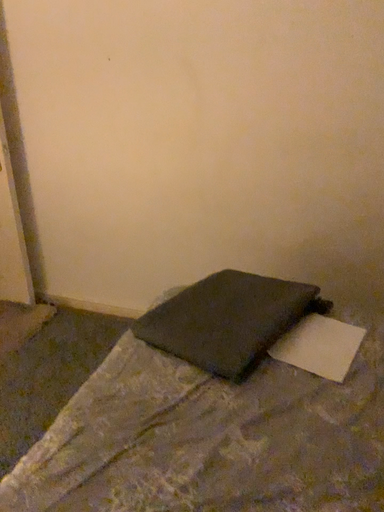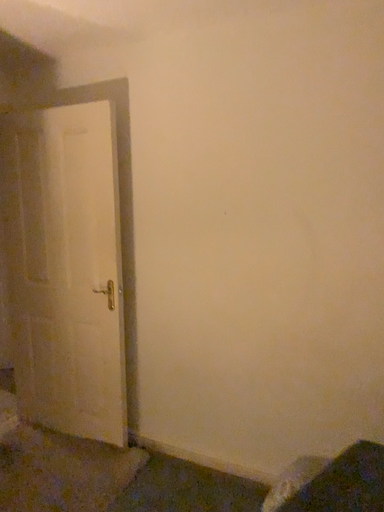
Question: How did the camera likely rotate when shooting the video?

Choices:
 (A) rotated right
 (B) rotated left

Answer: (B)